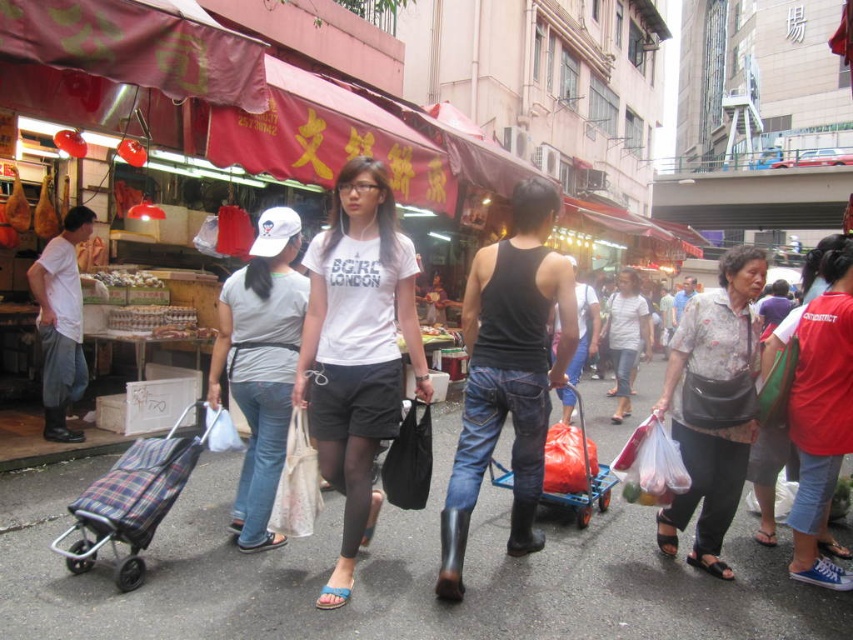
Question: Among these points, which one is nearest to the camera?

Choices:
 (A) (490, 483)
 (B) (112, 483)
 (C) (288, 387)
 (D) (341, 312)

Answer: (D)

Question: Is white matte t-shirt at center positioned at the back of gray fabric shirt at center?

Choices:
 (A) no
 (B) yes

Answer: (A)

Question: Can you confirm if gray fabric shirt at center is positioned below plaid fabric cart at lower left?

Choices:
 (A) no
 (B) yes

Answer: (A)

Question: Which of the following is the farthest from the observer?

Choices:
 (A) white matte t-shirt at center
 (B) printed fabric blouse at center
 (C) smooth asphalt road at center
 (D) red cotton shirt at right

Answer: (B)

Question: Is gray fabric shirt at center above red cotton shirt at right?

Choices:
 (A) no
 (B) yes

Answer: (B)

Question: Which of the following is the farthest from the observer?

Choices:
 (A) (697, 378)
 (B) (111, 545)
 (C) (827, 531)
 (D) (213, 369)

Answer: (C)